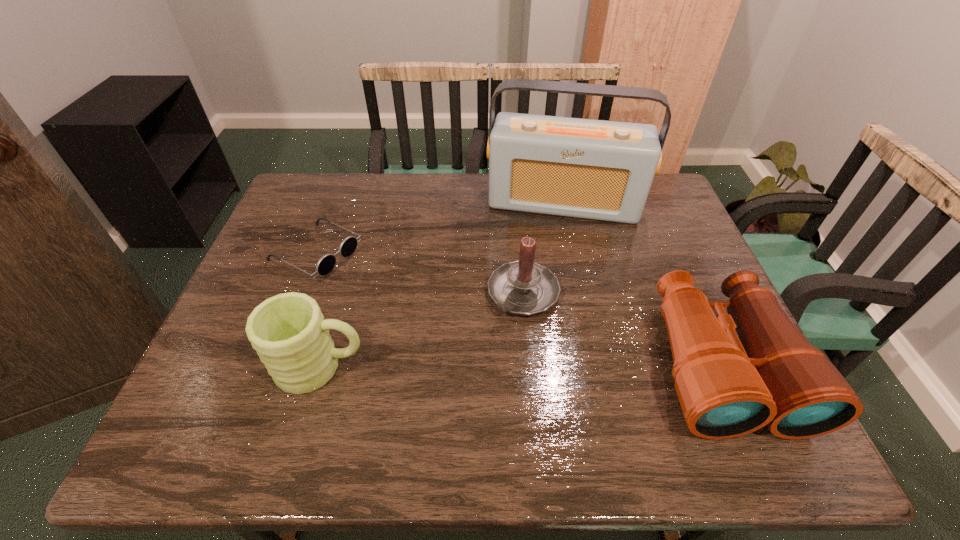
Find the location of a particular element. The image size is (960, 540). free spot on the desktop that is between the mug and the binoculars and is positioned on the front-facing side of the shortest object is located at coordinates (542, 366).

What are the coordinates of `vacant space on the desktop that is between the mug and the binoculars and is positioned on the front-facing side of the tallest object` in the screenshot? It's located at (549, 366).

What are the coordinates of `free space on the desktop that is between the mug and the binoculars and is positioned on the side of the candle with the handle loop` in the screenshot? It's located at (463, 366).